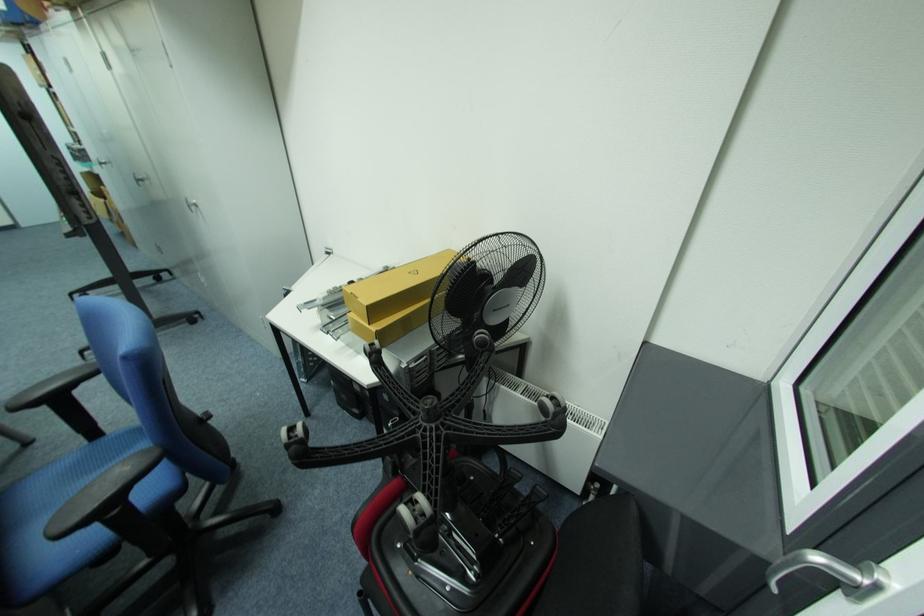
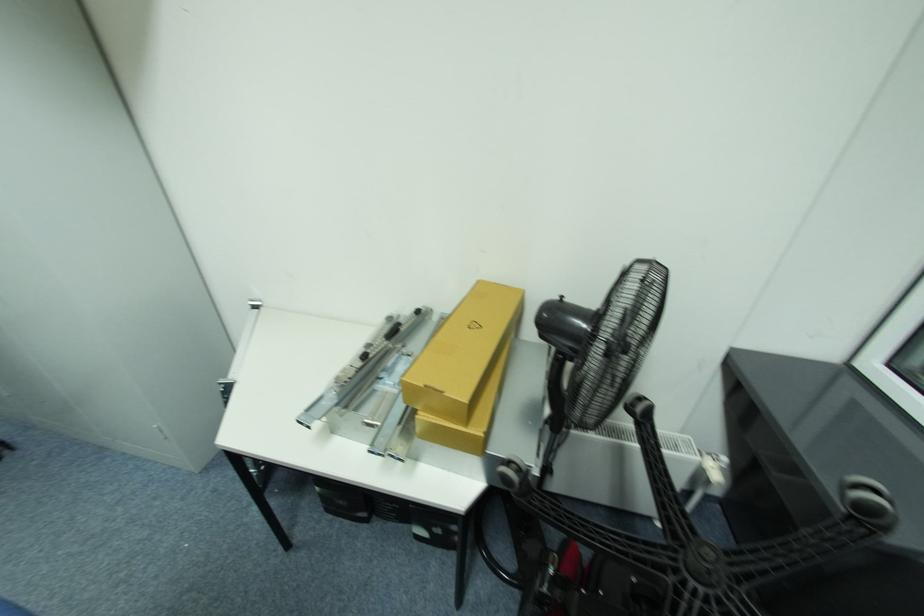
Question: The camera is either moving clockwise (left) or counter-clockwise (right) around the object. The first image is from the beginning of the video and the second image is from the end. Is the camera moving left or right when shooting the video?

Choices:
 (A) Left
 (B) Right

Answer: (A)